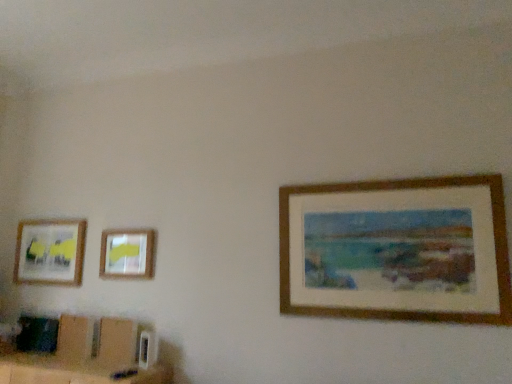
Identify the location of wooden picture frame at right, positioned as the first picture frame in front-to-back order. (397, 250).

This screenshot has height=384, width=512. Describe the element at coordinates (127, 254) in the screenshot. I see `matte plastic picture frame at upper left, positioned as the second picture frame in front-to-back order` at that location.

Find the location of a particular element. Image resolution: width=512 pixels, height=384 pixels. matte wooden picture frame at left, the first picture frame positioned from the back is located at coordinates (50, 252).

Find the location of a particular element. The height and width of the screenshot is (384, 512). wooden picture frame at right, which ranks as the 3th picture frame in back-to-front order is located at coordinates (397, 250).

Can you tell me how much matte plastic picture frame at upper left, placed as the second picture frame when sorted from back to front, and matte wooden picture frame at left, which is the third picture frame from front to back, differ in facing direction?

matte plastic picture frame at upper left, placed as the second picture frame when sorted from back to front, and matte wooden picture frame at left, which is the third picture frame from front to back, are facing 0.359 degrees away from each other.

Is matte wooden picture frame at left, acting as the third picture frame starting from the right, at the back of matte plastic picture frame at upper left, which is counted as the second picture frame, starting from the left?

That's not correct — matte plastic picture frame at upper left, which is counted as the second picture frame, starting from the left, is not looking away from matte wooden picture frame at left, acting as the third picture frame starting from the right.

Are matte plastic picture frame at upper left, placed as the second picture frame when sorted from back to front, and matte wooden picture frame at left, acting as the third picture frame starting from the right, beside each other?

No, matte plastic picture frame at upper left, placed as the second picture frame when sorted from back to front, is not with matte wooden picture frame at left, acting as the third picture frame starting from the right.

Considering the sizes of objects matte plastic picture frame at upper left, placed as the second picture frame when sorted from back to front, and matte wooden picture frame at left, acting as the third picture frame starting from the right, in the image provided, who is taller, matte plastic picture frame at upper left, placed as the second picture frame when sorted from back to front, or matte wooden picture frame at left, acting as the third picture frame starting from the right,?

matte wooden picture frame at left, acting as the third picture frame starting from the right, is taller.

Does wooden picture frame at right, the first picture frame from the right, lie behind matte plastic picture frame at upper left, placed as the second picture frame when sorted from back to front?

No, the depth of wooden picture frame at right, the first picture frame from the right, is less than that of matte plastic picture frame at upper left, placed as the second picture frame when sorted from back to front.

From the image's perspective, which object appears higher, wooden picture frame at right, the first picture frame from the right, or matte plastic picture frame at upper left, placed as the second picture frame when sorted from back to front?

wooden picture frame at right, the first picture frame from the right, from the image's perspective.

Locate an element on the screen. the 2nd picture frame directly above the matte plastic picture frame at upper left, arranged as the 2th picture frame when viewed from the right (from a real-world perspective) is located at coordinates (397, 250).

Which is more to the left, matte plastic picture frame at upper left, positioned as the second picture frame in front-to-back order, or wooden picture frame at right, the first picture frame from the right?

matte plastic picture frame at upper left, positioned as the second picture frame in front-to-back order.

Measure the distance from matte plastic picture frame at upper left, arranged as the 2th picture frame when viewed from the right, to wooden picture frame at right, the first picture frame from the right.

They are 1.33 meters apart.

From a real-world perspective, between matte plastic picture frame at upper left, placed as the second picture frame when sorted from back to front, and wooden picture frame at right, the first picture frame from the right, who is vertically higher?

wooden picture frame at right, the first picture frame from the right.

Does matte plastic picture frame at upper left, positioned as the second picture frame in front-to-back order, have a lesser height compared to wooden picture frame at right, positioned as the first picture frame in front-to-back order?

Correct, matte plastic picture frame at upper left, positioned as the second picture frame in front-to-back order, is not as tall as wooden picture frame at right, positioned as the first picture frame in front-to-back order.

Relative to matte wooden picture frame at left, the 1th picture frame when ordered from left to right, is wooden picture frame at right, which ranks as the 3th picture frame in back-to-front order, in front or behind?

wooden picture frame at right, which ranks as the 3th picture frame in back-to-front order, is positioned closer to the viewer than matte wooden picture frame at left, the 1th picture frame when ordered from left to right.

Choose the correct answer: Is wooden picture frame at right, the first picture frame from the right, inside matte wooden picture frame at left, the 1th picture frame when ordered from left to right, or outside it?

wooden picture frame at right, the first picture frame from the right, exists outside the volume of matte wooden picture frame at left, the 1th picture frame when ordered from left to right.

Which of these two, wooden picture frame at right, which ranks as the 3th picture frame in back-to-front order, or matte wooden picture frame at left, the first picture frame positioned from the back, is wider?

With larger width is wooden picture frame at right, which ranks as the 3th picture frame in back-to-front order.

In the scene shown: How distant is matte wooden picture frame at left, the 1th picture frame when ordered from left to right, from matte plastic picture frame at upper left, positioned as the second picture frame in front-to-back order?

matte wooden picture frame at left, the 1th picture frame when ordered from left to right, is 16.07 inches away from matte plastic picture frame at upper left, positioned as the second picture frame in front-to-back order.

Is point (80, 282) behind point (149, 249)?

Yes, it is behind point (149, 249).

From the image's perspective, is matte wooden picture frame at left, the 1th picture frame when ordered from left to right, above or below matte plastic picture frame at upper left, placed as the second picture frame when sorted from back to front?

matte wooden picture frame at left, the 1th picture frame when ordered from left to right, is situated lower than matte plastic picture frame at upper left, placed as the second picture frame when sorted from back to front, in the image.

In the scene shown: Is matte wooden picture frame at left, the 1th picture frame when ordered from left to right, inside or outside of matte plastic picture frame at upper left, placed as the second picture frame when sorted from back to front?

matte wooden picture frame at left, the 1th picture frame when ordered from left to right, exists outside the volume of matte plastic picture frame at upper left, placed as the second picture frame when sorted from back to front.

From a real-world perspective, is matte wooden picture frame at left, acting as the third picture frame starting from the right, located higher than wooden picture frame at right, positioned as the first picture frame in front-to-back order?

No.

Is the surface of matte wooden picture frame at left, the 1th picture frame when ordered from left to right, in direct contact with wooden picture frame at right, which ranks as the 3th picture frame in back-to-front order?

matte wooden picture frame at left, the 1th picture frame when ordered from left to right, is not next to wooden picture frame at right, which ranks as the 3th picture frame in back-to-front order, and they're not touching.

Is matte wooden picture frame at left, which is the third picture frame from front to back, wider than wooden picture frame at right, the third picture frame positioned from the left?

Incorrect, the width of matte wooden picture frame at left, which is the third picture frame from front to back, does not surpass that of wooden picture frame at right, the third picture frame positioned from the left.

Image resolution: width=512 pixels, height=384 pixels. I want to click on picture frame located below the matte plastic picture frame at upper left, which is counted as the second picture frame, starting from the left (from the image's perspective), so click(x=50, y=252).

Identify the location of picture frame that is the 2nd object above the matte plastic picture frame at upper left, positioned as the second picture frame in front-to-back order (from a real-world perspective). (397, 250).

Which object lies nearer to the anchor point wooden picture frame at right, the first picture frame from the right, matte wooden picture frame at left, acting as the third picture frame starting from the right, or matte plastic picture frame at upper left, arranged as the 2th picture frame when viewed from the right?

matte plastic picture frame at upper left, arranged as the 2th picture frame when viewed from the right, is positioned closer to the anchor wooden picture frame at right, the first picture frame from the right.

Looking at the image, which one is located further to matte wooden picture frame at left, the first picture frame positioned from the back, wooden picture frame at right, the first picture frame from the right, or matte plastic picture frame at upper left, arranged as the 2th picture frame when viewed from the right?

wooden picture frame at right, the first picture frame from the right, lies further to matte wooden picture frame at left, the first picture frame positioned from the back, than the other object.

Based on their spatial positions, is matte wooden picture frame at left, the first picture frame positioned from the back, or wooden picture frame at right, the first picture frame from the right, closer to matte plastic picture frame at upper left, arranged as the 2th picture frame when viewed from the right?

matte wooden picture frame at left, the first picture frame positioned from the back.

From the image, which object appears to be farther from wooden picture frame at right, the first picture frame from the right, matte plastic picture frame at upper left, which is counted as the second picture frame, starting from the left, or matte wooden picture frame at left, the first picture frame positioned from the back?

matte wooden picture frame at left, the first picture frame positioned from the back, is positioned further to the anchor wooden picture frame at right, the first picture frame from the right.

In the scene shown: From the image, which object appears to be farther from matte plastic picture frame at upper left, arranged as the 2th picture frame when viewed from the right, wooden picture frame at right, the third picture frame positioned from the left, or matte wooden picture frame at left, the 1th picture frame when ordered from left to right?

Among the two, wooden picture frame at right, the third picture frame positioned from the left, is located further to matte plastic picture frame at upper left, arranged as the 2th picture frame when viewed from the right.

Considering their positions, is matte plastic picture frame at upper left, which is counted as the second picture frame, starting from the left, positioned further to matte wooden picture frame at left, which is the third picture frame from front to back, than wooden picture frame at right, the first picture frame from the right?

wooden picture frame at right, the first picture frame from the right, is positioned further to the anchor matte wooden picture frame at left, which is the third picture frame from front to back.

In order to click on picture frame located between matte wooden picture frame at left, the first picture frame positioned from the back, and wooden picture frame at right, the first picture frame from the right, in the left-right direction in this screenshot , I will do `click(127, 254)`.